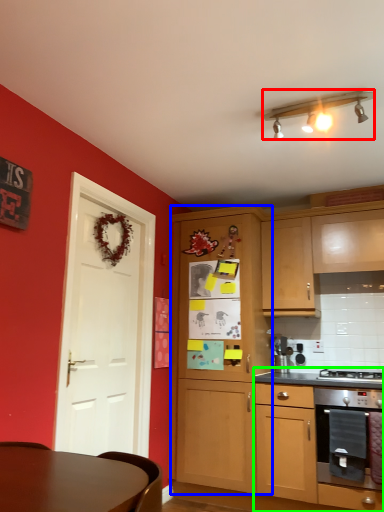
Question: Based on their relative distances, which object is farther from lamp (highlighted by a red box)? Choose from cabinetry (highlighted by a blue box) and cabinetry (highlighted by a green box).

Choices:
 (A) cabinetry
 (B) cabinetry

Answer: (B)